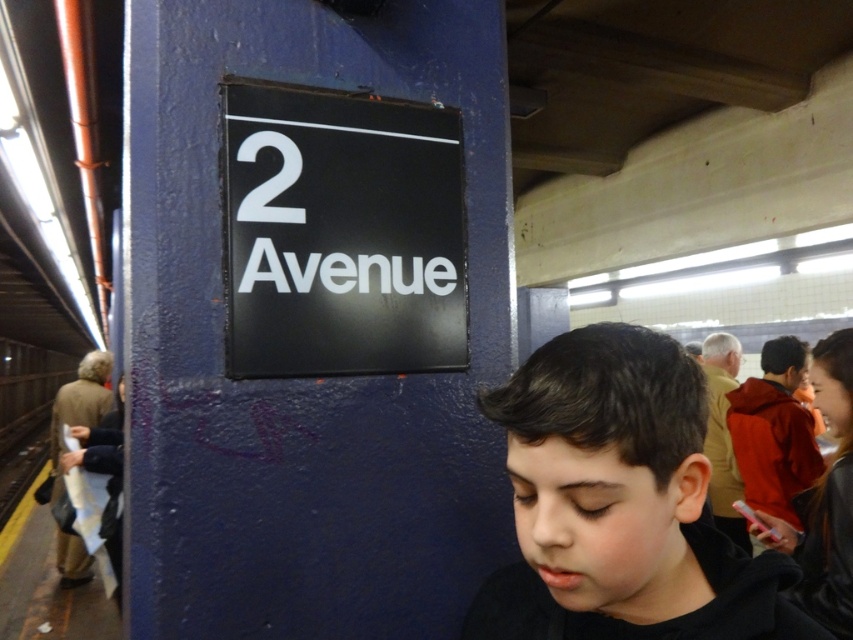
Where is `black matte hair at center`? black matte hair at center is located at coordinates (619, 502).

At what (x,y) coordinates should I click in order to perform the action: click on black matte hair at center. Please return your answer as a coordinate pair (x, y). Looking at the image, I should click on (619, 502).

Does black matte sign at center have a greater width compared to white matte number at upper center?

Indeed, black matte sign at center has a greater width compared to white matte number at upper center.

Can you confirm if black matte sign at center is positioned to the left of white matte number at upper center?

No, black matte sign at center is not to the left of white matte number at upper center.

This screenshot has width=853, height=640. I want to click on black matte sign at center, so click(x=341, y=234).

Identify the location of black matte sign at center. The image size is (853, 640). (341, 234).

Between point (561, 339) and point (300, 212), which one is positioned behind?

The point (300, 212) is more distant.

Based on the photo, who is taller, black matte hair at center or white matte number at upper center?

Standing taller between the two is black matte hair at center.

Between point (642, 467) and point (271, 220), which one is positioned in front?

Point (642, 467) is in front.

The height and width of the screenshot is (640, 853). In order to click on black matte hair at center in this screenshot , I will do `click(619, 502)`.